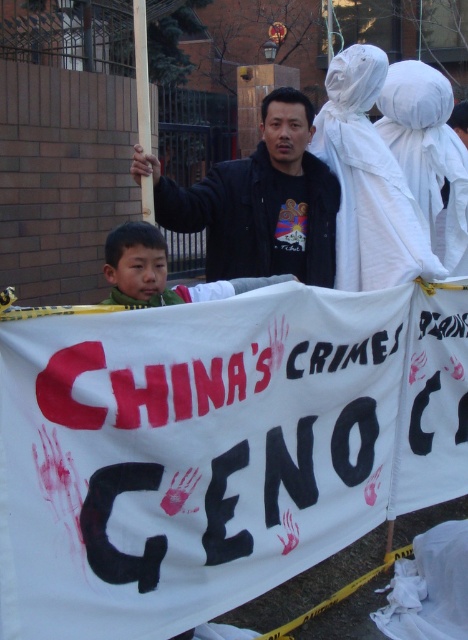
Question: Does black matte jacket at center appear over green fuzzy jacket at center?

Choices:
 (A) yes
 (B) no

Answer: (A)

Question: Is black matte jacket at center bigger than green fuzzy jacket at center?

Choices:
 (A) no
 (B) yes

Answer: (B)

Question: Which point is closer to the camera?

Choices:
 (A) (219, 291)
 (B) (305, 106)

Answer: (A)

Question: Does black matte jacket at center appear over green fuzzy jacket at center?

Choices:
 (A) no
 (B) yes

Answer: (B)

Question: Which of the following is the closest to the observer?

Choices:
 (A) (129, 292)
 (B) (255, 268)

Answer: (A)

Question: Which point is closer to the camera taking this photo?

Choices:
 (A) (224, 253)
 (B) (130, 225)

Answer: (B)